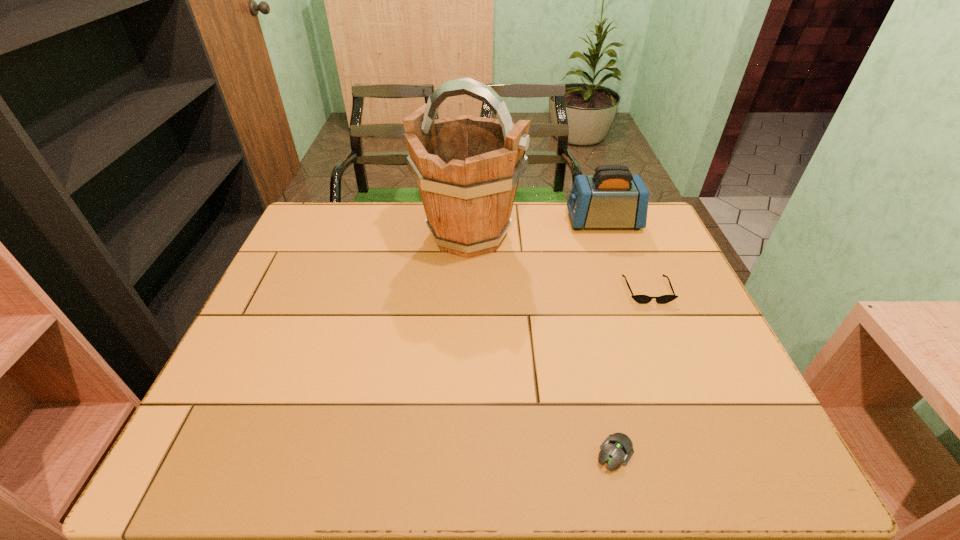
Image resolution: width=960 pixels, height=540 pixels. Find the location of `bucket`. bucket is located at coordinates coord(467,168).

I want to click on the tallest object, so click(x=467, y=168).

At what (x,y) coordinates should I click in order to perform the action: click on the third shortest object. Please return your answer as a coordinate pair (x, y). Looking at the image, I should click on (611, 198).

This screenshot has height=540, width=960. Find the location of `the second nearest object`. the second nearest object is located at coordinates (641, 299).

I want to click on sunglasses, so click(641, 299).

Locate an element on the screen. computer mouse is located at coordinates (617, 448).

Where is `the shortest object`? the shortest object is located at coordinates (617, 448).

I want to click on vacant space located on the right of the leftmost object, so click(614, 234).

This screenshot has height=540, width=960. Find the location of `free space located on the front-facing side of the third shortest object`. free space located on the front-facing side of the third shortest object is located at coordinates (531, 222).

This screenshot has width=960, height=540. Identify the location of free spot located on the front-facing side of the third shortest object. (506, 222).